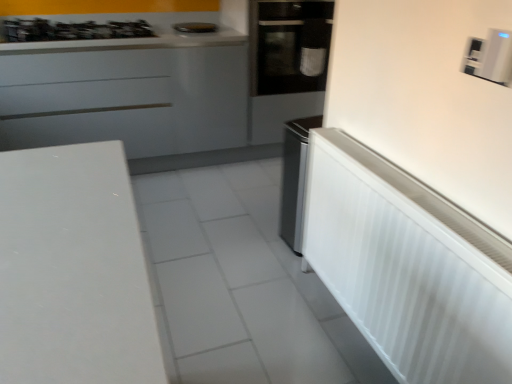
Question: Is point (201, 29) positioned closer to the camera than point (288, 39)?

Choices:
 (A) closer
 (B) farther

Answer: (B)

Question: In terms of height, does metallic silver toaster at upper center, the third appliance positioned from the right, look taller or shorter compared to black glass oven at center?

Choices:
 (A) tall
 (B) short

Answer: (B)

Question: Estimate the real-world distances between objects in this image. Which object is farther from the black glass oven at center?

Choices:
 (A) metallic silver toaster at upper center, which is the 1th appliance from back to front
 (B) white plastic radiator at right, positioned as the 3th appliance in top-to-bottom order
 (C) white glossy cabinet at upper left
 (D) metallic silver gas stove at upper left
 (E) white plastic thermostat at upper right, the third appliance when ordered from left to right

Answer: (E)

Question: Considering the real-world distances, which object is farthest from the metallic silver gas stove at upper left?

Choices:
 (A) black glass oven at center
 (B) metallic silver toaster at upper center, the first appliance in the top-to-bottom sequence
 (C) white plastic thermostat at upper right, the second appliance positioned from the back
 (D) white plastic radiator at right, which ranks as the 1th appliance in front-to-back order
 (E) white glossy cabinet at upper left

Answer: (C)